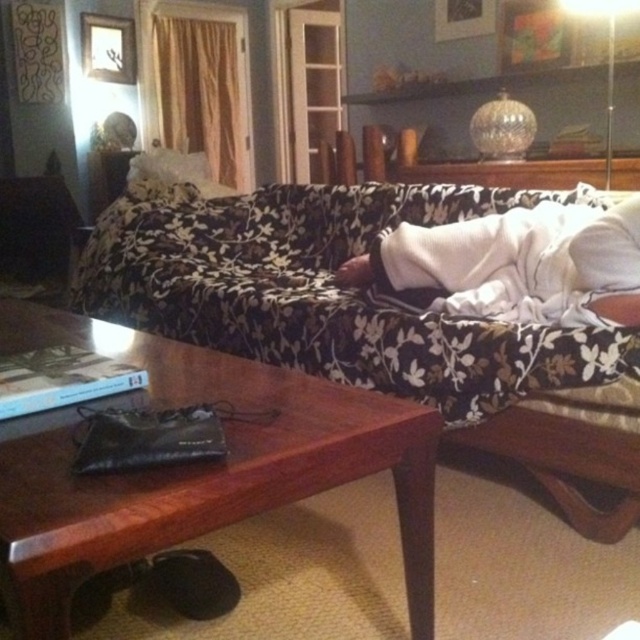
Is white soft blanket at center taller than white soft pillow at upper right?

Correct, white soft blanket at center is much taller as white soft pillow at upper right.

From the picture: Is white soft blanket at center closer to camera compared to white soft pillow at upper right?

That is False.

Which is behind, point (620, 224) or point (618, 264)?

Positioned behind is point (620, 224).

Where is `white soft blanket at center`? The width and height of the screenshot is (640, 640). white soft blanket at center is located at coordinates (516, 262).

Consider the image. Can you confirm if floral fabric couch at center is positioned to the right of white soft blanket at center?

No, floral fabric couch at center is not to the right of white soft blanket at center.

Locate an element on the screen. This screenshot has width=640, height=640. floral fabric couch at center is located at coordinates (372, 321).

Between floral fabric couch at center and white soft pillow at upper right, which one has more height?

Standing taller between the two is floral fabric couch at center.

Which is more to the left, floral fabric couch at center or white soft pillow at upper right?

floral fabric couch at center is more to the left.

Is point (148, 298) closer to viewer compared to point (616, 248)?

No, it is behind (616, 248).

You are a GUI agent. You are given a task and a screenshot of the screen. Output one action in this format:
    pyautogui.click(x=<x>, y=<y>)
    Task: Click on the floral fabric couch at center
    The width and height of the screenshot is (640, 640).
    Given the screenshot: What is the action you would take?
    pyautogui.click(x=372, y=321)